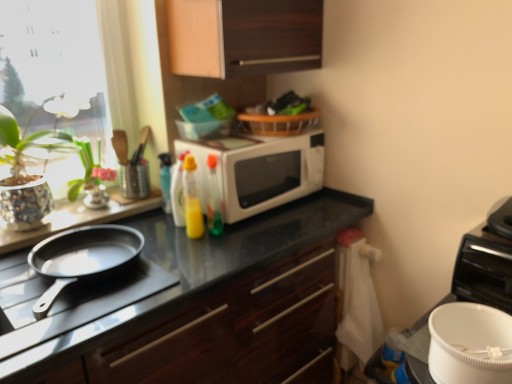
You are a GUI agent. You are given a task and a screenshot of the screen. Output one action in this format:
    pyautogui.click(x=<x>, y=<y>)
    Task: Click on the free location above black matte pan at left (from a real-world perspective)
    
    Given the screenshot: What is the action you would take?
    pyautogui.click(x=60, y=298)